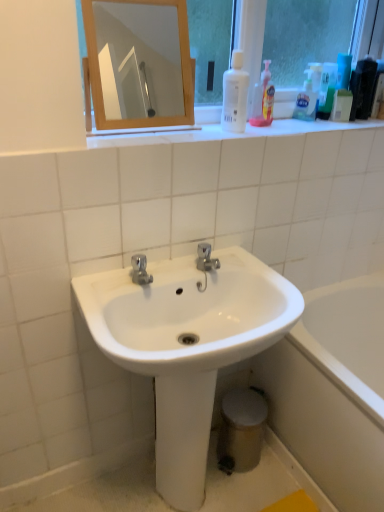
Question: Is translucent plastic bottle at upper right, which is the 2th cleaning product from right to left, positioned behind wooden mirror at upper center?

Choices:
 (A) yes
 (B) no

Answer: (A)

Question: Does translucent plastic bottle at upper right, which is the 2th cleaning product from right to left, touch wooden mirror at upper center?

Choices:
 (A) yes
 (B) no

Answer: (B)

Question: Does translucent plastic bottle at upper right, which is the 2th cleaning product from left to right, turn towards wooden mirror at upper center?

Choices:
 (A) yes
 (B) no

Answer: (B)

Question: Can you confirm if translucent plastic bottle at upper right, which is the 2th cleaning product from left to right, is taller than wooden mirror at upper center?

Choices:
 (A) no
 (B) yes

Answer: (A)

Question: Is translucent plastic bottle at upper right, which is the 2th cleaning product from left to right, positioned far away from wooden mirror at upper center?

Choices:
 (A) no
 (B) yes

Answer: (B)

Question: Can you confirm if translucent plastic bottle at upper right, which is the 2th cleaning product from left to right, is shorter than wooden mirror at upper center?

Choices:
 (A) no
 (B) yes

Answer: (B)

Question: Are white glossy bottle at upper center, which is the first cleaning product in left-to-right order, and white glossy sink at center beside each other?

Choices:
 (A) no
 (B) yes

Answer: (A)

Question: Does white glossy bottle at upper center, the third cleaning product from the right, appear on the right side of white glossy sink at center?

Choices:
 (A) yes
 (B) no

Answer: (A)

Question: Considering the relative sizes of white glossy bottle at upper center, which is the first cleaning product in left-to-right order, and white glossy sink at center in the image provided, is white glossy bottle at upper center, which is the first cleaning product in left-to-right order, thinner than white glossy sink at center?

Choices:
 (A) no
 (B) yes

Answer: (B)

Question: Is white glossy bottle at upper center, the third cleaning product from the right, shorter than white glossy sink at center?

Choices:
 (A) no
 (B) yes

Answer: (B)

Question: From a real-world perspective, does white glossy bottle at upper center, the third cleaning product from the right, sit lower than white glossy sink at center?

Choices:
 (A) no
 (B) yes

Answer: (A)

Question: From a real-world perspective, is white glossy bottle at upper center, the third cleaning product from the right, on top of white glossy sink at center?

Choices:
 (A) yes
 (B) no

Answer: (A)

Question: Is the depth of white glossy sink at center less than that of white glossy bathtub at lower right?

Choices:
 (A) no
 (B) yes

Answer: (B)